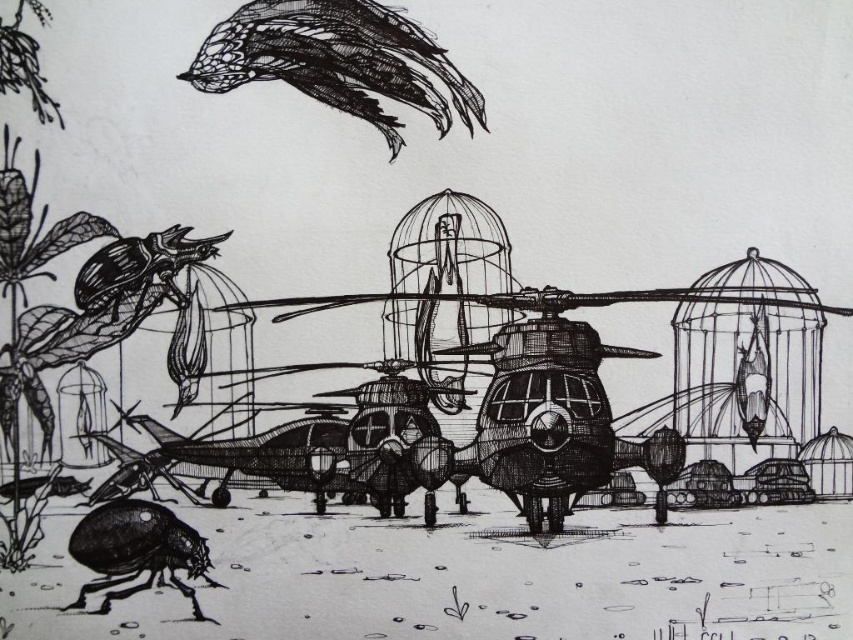
Question: Which point is closer to the camera?

Choices:
 (A) [175, 244]
 (B) [119, 497]

Answer: (B)

Question: Which object is closer to the camera taking this photo?

Choices:
 (A) shiny black beetle at lower left
 (B) matte black beetle at upper left

Answer: (A)

Question: Does shiny black beetle at lower left appear over matte black beetle at upper left?

Choices:
 (A) no
 (B) yes

Answer: (A)

Question: Which object is closer to the camera taking this photo?

Choices:
 (A) matte black beetle at upper left
 (B) shiny black beetle at lower left

Answer: (B)

Question: Is shiny black beetle at lower left closer to camera compared to matte black beetle at upper left?

Choices:
 (A) no
 (B) yes

Answer: (B)

Question: Can you confirm if shiny black beetle at lower left is positioned to the left of matte black beetle at upper left?

Choices:
 (A) yes
 (B) no

Answer: (A)